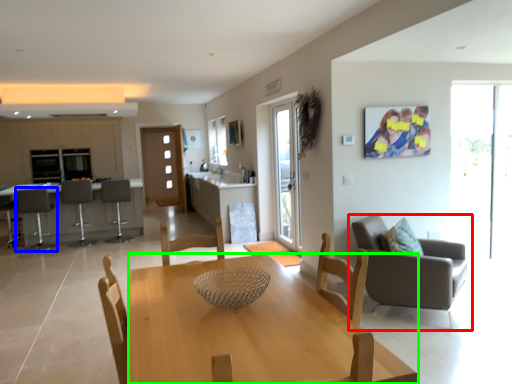
Question: Estimate the real-world distances between objects in this image. Which object is farther from chair (highlighted by a red box), chair (highlighted by a blue box) or desk (highlighted by a green box)?

Choices:
 (A) chair
 (B) desk

Answer: (A)